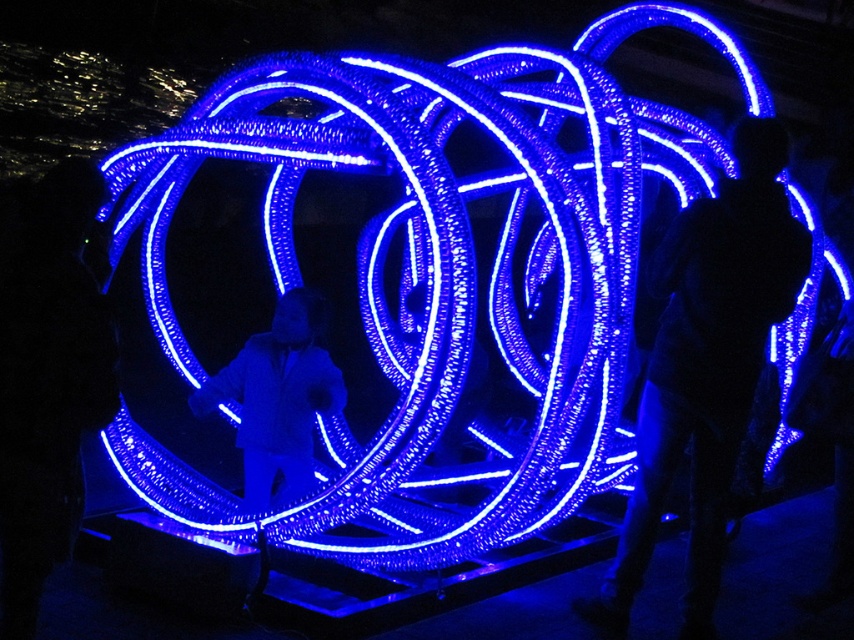
Which is below, silhouette figure at right or matte black suit at center?

silhouette figure at right

This screenshot has height=640, width=854. What do you see at coordinates (706, 368) in the screenshot? I see `silhouette figure at right` at bounding box center [706, 368].

This screenshot has width=854, height=640. I want to click on silhouette figure at right, so click(706, 368).